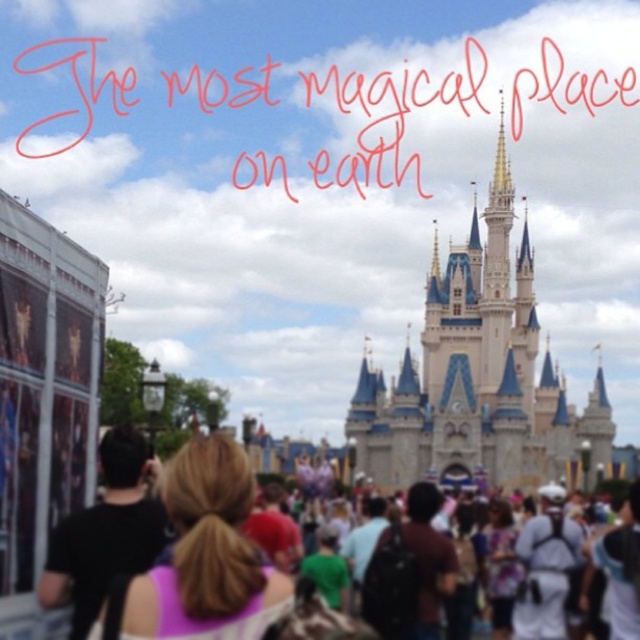
Between blurred people at center and blonde hair at center, which one has more height?

blurred people at center

What do you see at coordinates (480, 444) in the screenshot?
I see `blurred people at center` at bounding box center [480, 444].

Which is behind, point (179, 564) or point (186, 608)?

Positioned behind is point (179, 564).

At what (x,y) coordinates should I click in order to perform the action: click on blurred people at center. Please return your answer as a coordinate pair (x, y). Looking at the image, I should click on (480, 444).

Find the location of a particular element. Image resolution: width=640 pixels, height=640 pixels. white stone castle at center is located at coordinates (477, 376).

Is white stone castle at center to the left of blurred people at center from the viewer's perspective?

In fact, white stone castle at center is to the right of blurred people at center.

Does point (445, 384) come behind point (408, 444)?

Yes.

The height and width of the screenshot is (640, 640). Find the location of `white stone castle at center`. white stone castle at center is located at coordinates (477, 376).

You are a GUI agent. You are given a task and a screenshot of the screen. Output one action in this format:
    pyautogui.click(x=<x>, y=<y>)
    Task: Click on the white stone castle at center
    The height and width of the screenshot is (640, 640).
    Given the screenshot: What is the action you would take?
    pyautogui.click(x=477, y=376)

Is point (413, 440) closer to camera compared to point (195, 504)?

No.

Find the location of a particular element. The image size is (640, 640). white stone castle at center is located at coordinates (477, 376).